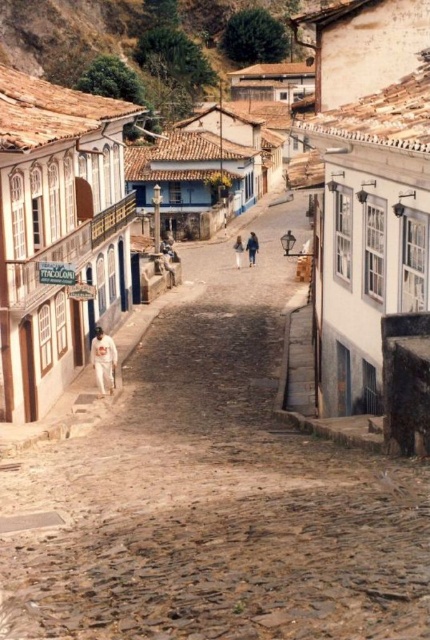
Measure the distance between white cotton pants at lower left and light blue jeans at center.

white cotton pants at lower left is 21.35 meters from light blue jeans at center.

Is the position of white cotton pants at lower left less distant than that of light blue jeans at center?

That is True.

Which is in front, point (103, 387) or point (240, 260)?

Point (103, 387) is in front.

Where is `white cotton pants at lower left`? Image resolution: width=430 pixels, height=640 pixels. white cotton pants at lower left is located at coordinates (104, 360).

Between point (113, 349) and point (254, 259), which one is positioned behind?

The point (254, 259) is behind.

Is white cotton pants at lower left to the left of blue denim jeans at center from the viewer's perspective?

Answer: Indeed, white cotton pants at lower left is positioned on the left side of blue denim jeans at center.

In order to click on white cotton pants at lower left in this screenshot , I will do `click(104, 360)`.

Find the location of `white cotton pants at lower left`. white cotton pants at lower left is located at coordinates (104, 360).

Which is in front, point (251, 260) or point (239, 257)?

Point (239, 257) is in front.

Does point (257, 246) come in front of point (240, 243)?

Yes, it is in front of point (240, 243).

You are a GUI agent. You are given a task and a screenshot of the screen. Output one action in this format:
    pyautogui.click(x=<x>, y=<y>)
    Task: Click on the blue denim jeans at center
    
    Given the screenshot: What is the action you would take?
    pyautogui.click(x=251, y=248)